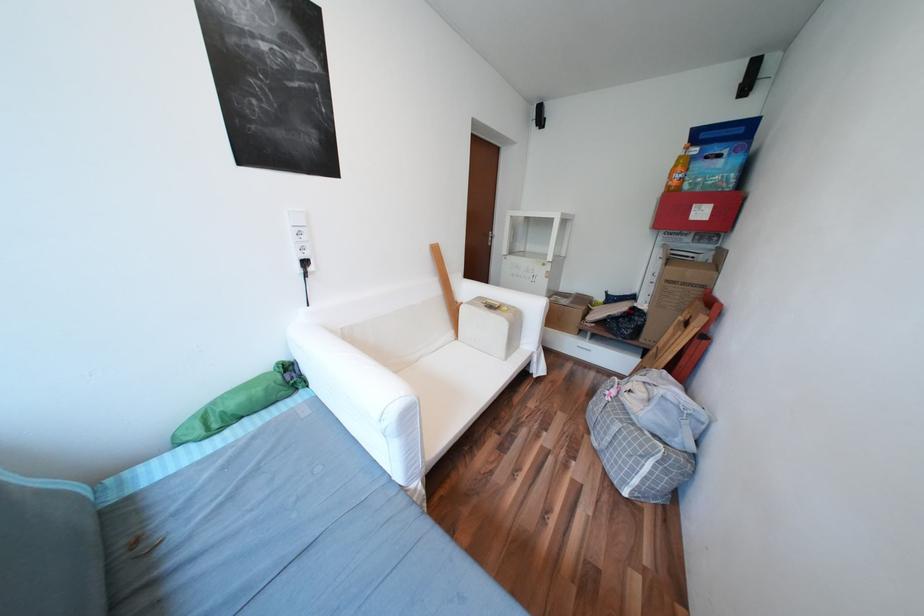
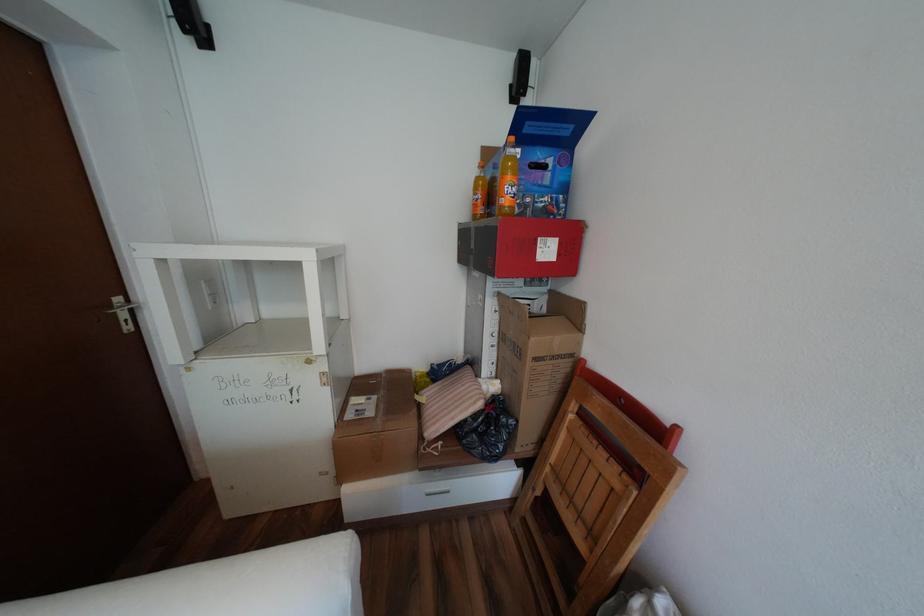
Locate, in the second image, the point that corresponds to point 665,275 in the first image.

(505, 334)